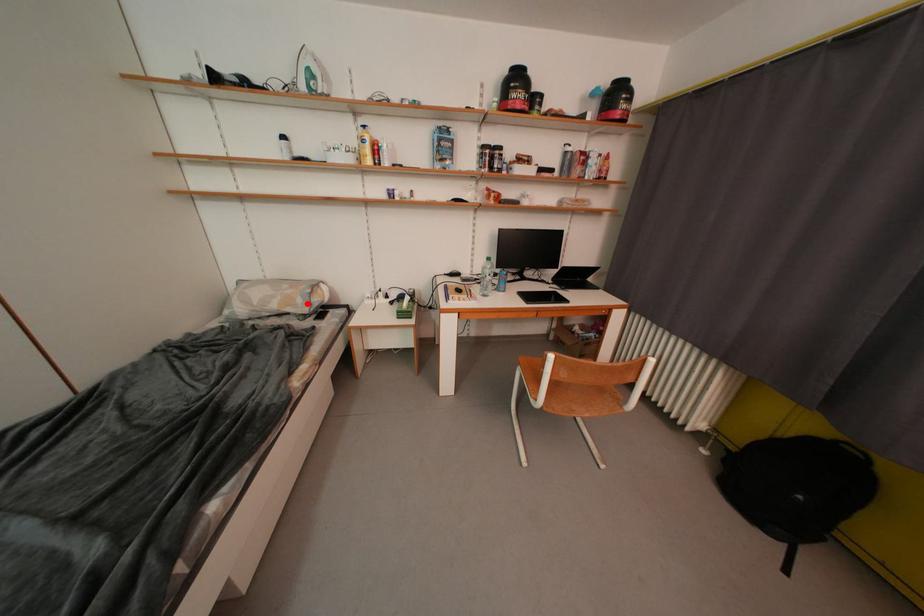
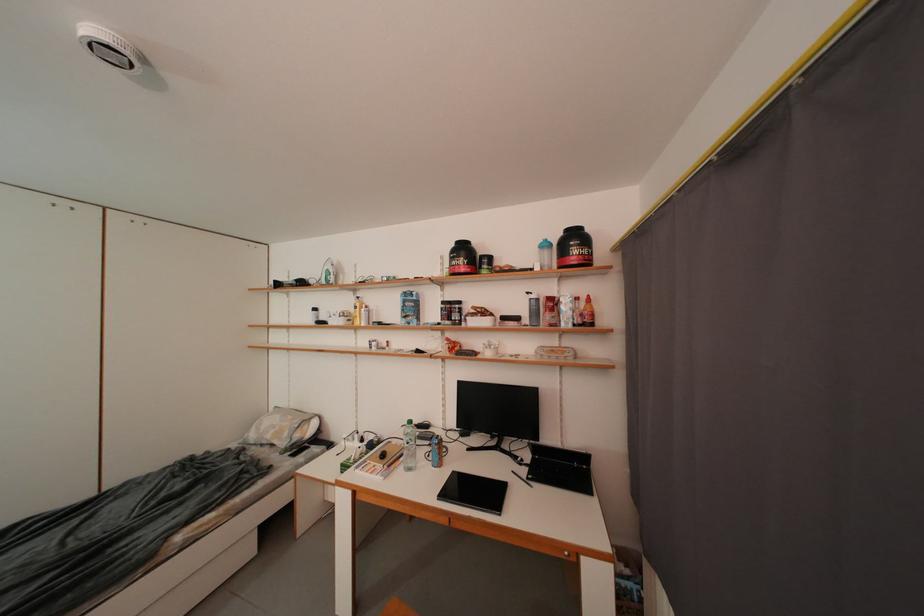
The point at the highlighted location is marked in the first image. Where is the corresponding point in the second image?

(294, 438)